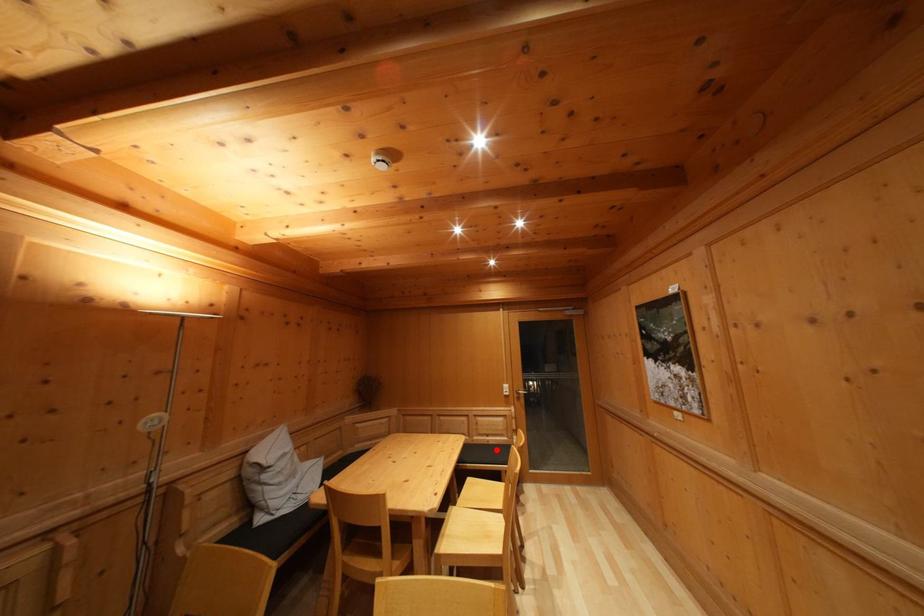
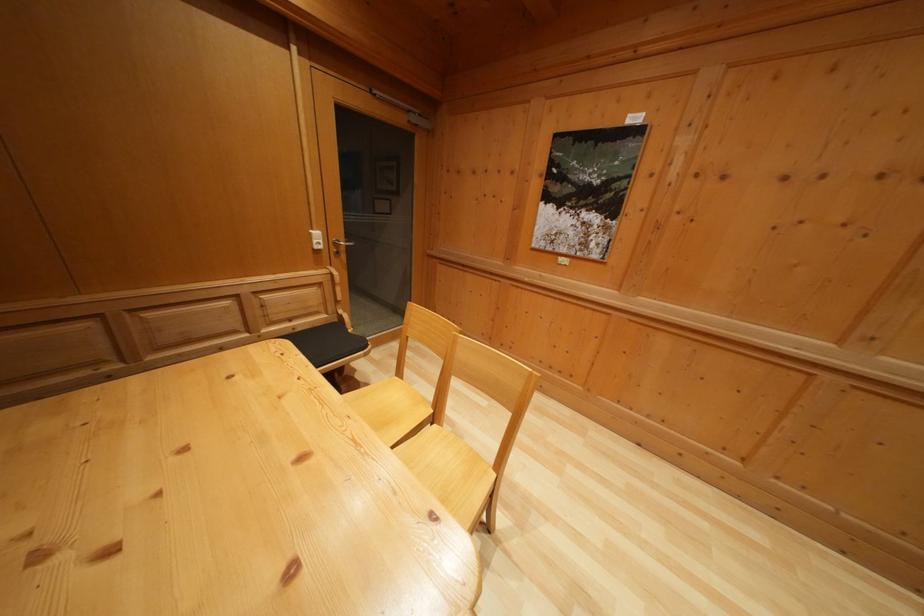
Question: I am providing you with two images of the same scene from different viewpoints. Image1 has a red point marked. In image2, the corresponding 3D location appears at what relative position? Reply with the corresponding letter.

Choices:
 (A) Closer
 (B) Farther

Answer: (A)